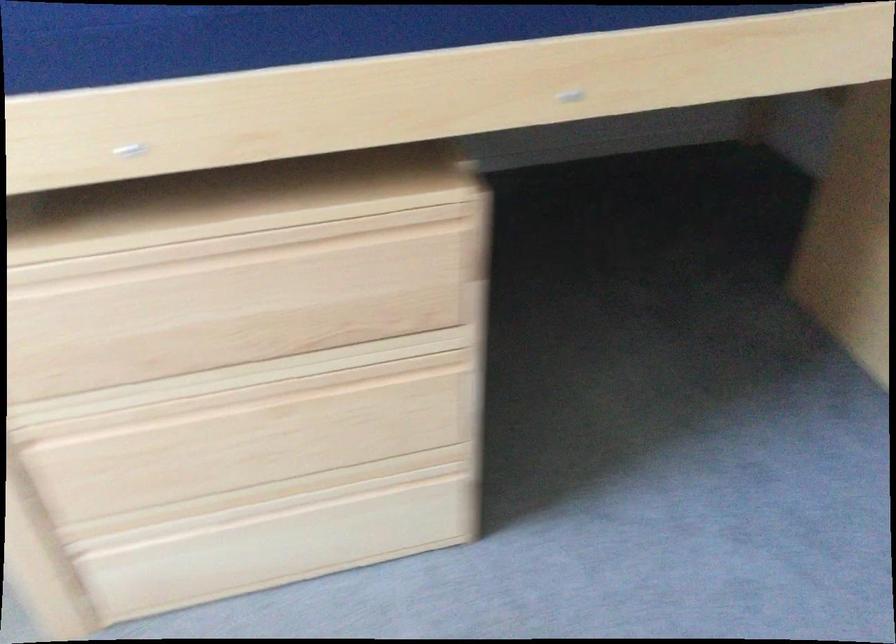
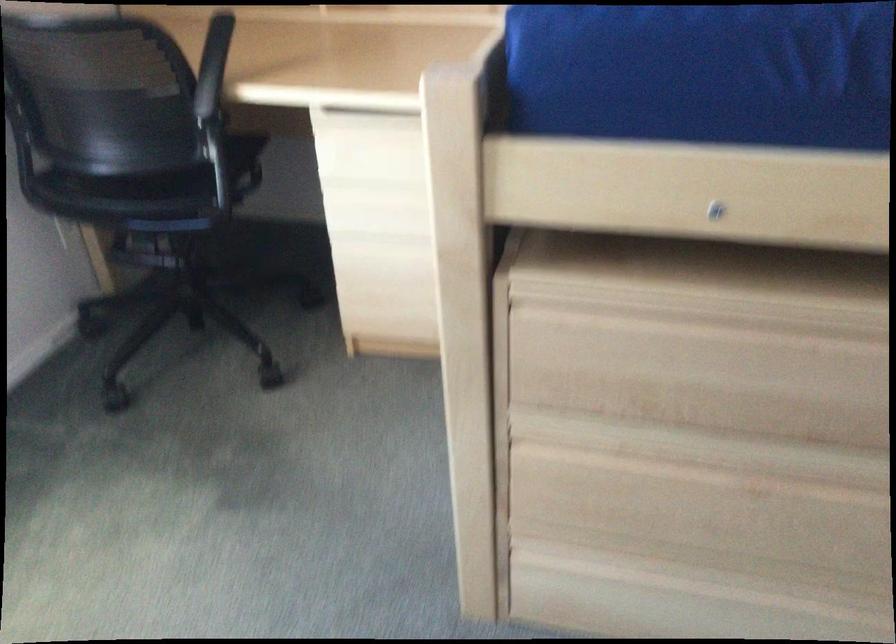
In the second image, find the point that corresponds to point 179,260 in the first image.

(711, 321)